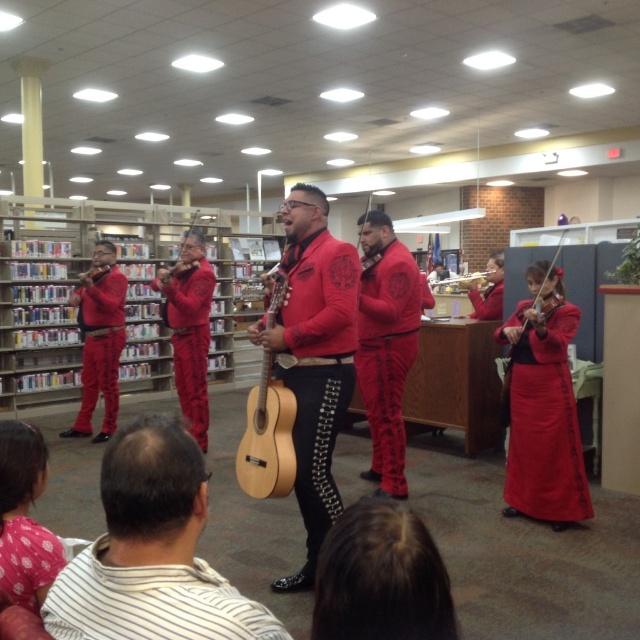
Question: Which point is farther to the camera?

Choices:
 (A) (301, 269)
 (B) (376, 390)

Answer: (B)

Question: Does matte red mariachi suit at center appear under matte red pantsuit at left?

Choices:
 (A) yes
 (B) no

Answer: (A)

Question: Can you confirm if matte red mariachi outfit at center is bigger than matte red violin at left?

Choices:
 (A) no
 (B) yes

Answer: (B)

Question: Which object is the farthest from the matte red violin at center?

Choices:
 (A) matte red pantsuit at left
 (B) matte red mariachi suit at center
 (C) matte red guitar at center

Answer: (C)

Question: Is matte red skirt at lower right bigger than matte red violin at left?

Choices:
 (A) no
 (B) yes

Answer: (B)

Question: Which point appears closest to the camera in this image?

Choices:
 (A) (172, 273)
 (B) (355, 362)

Answer: (B)